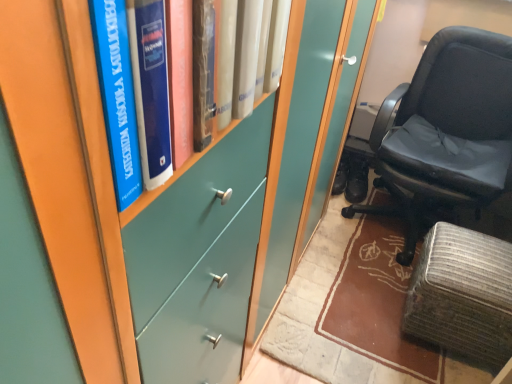
Question: Considering the relative sizes of textured gray ottoman at lower right and black leather chair at right in the image provided, is textured gray ottoman at lower right shorter than black leather chair at right?

Choices:
 (A) yes
 (B) no

Answer: (A)

Question: From the image's perspective, does textured gray ottoman at lower right appear lower than black leather chair at right?

Choices:
 (A) no
 (B) yes

Answer: (B)

Question: Is textured gray ottoman at lower right far away from black leather chair at right?

Choices:
 (A) no
 (B) yes

Answer: (A)

Question: Is textured gray ottoman at lower right taller than black leather chair at right?

Choices:
 (A) yes
 (B) no

Answer: (B)

Question: Is textured gray ottoman at lower right aimed at black leather chair at right?

Choices:
 (A) no
 (B) yes

Answer: (A)

Question: Would you say black leather chair at right is to the left or to the right of textured gray ottoman at lower right in the picture?

Choices:
 (A) right
 (B) left

Answer: (A)

Question: From a real-world perspective, is black leather chair at right physically located above or below textured gray ottoman at lower right?

Choices:
 (A) below
 (B) above

Answer: (B)

Question: Is black leather chair at right inside the boundaries of textured gray ottoman at lower right, or outside?

Choices:
 (A) inside
 (B) outside

Answer: (B)

Question: Does point (400, 102) appear closer or farther from the camera than point (476, 319)?

Choices:
 (A) closer
 (B) farther

Answer: (B)

Question: From their relative heights in the image, would you say blue hardcover book at left is taller or shorter than textured gray ottoman at lower right?

Choices:
 (A) tall
 (B) short

Answer: (B)

Question: Is blue hardcover book at left situated inside textured gray ottoman at lower right or outside?

Choices:
 (A) inside
 (B) outside

Answer: (B)

Question: Is blue hardcover book at left bigger or smaller than textured gray ottoman at lower right?

Choices:
 (A) small
 (B) big

Answer: (A)

Question: Looking at their shapes, would you say blue hardcover book at left is wider or thinner than textured gray ottoman at lower right?

Choices:
 (A) wide
 (B) thin

Answer: (B)

Question: In the image, is textured gray ottoman at lower right positioned in front of or behind black leather chair at right?

Choices:
 (A) front
 (B) behind

Answer: (B)

Question: From the image's perspective, is textured gray ottoman at lower right positioned above or below black leather chair at right?

Choices:
 (A) above
 (B) below

Answer: (B)